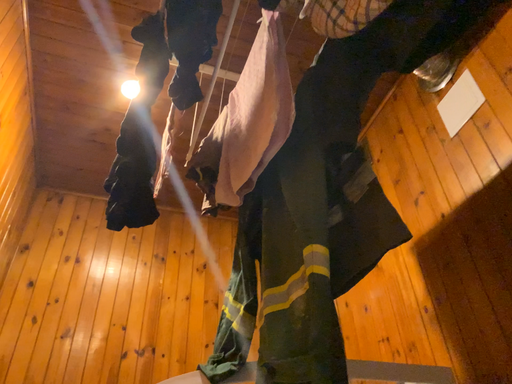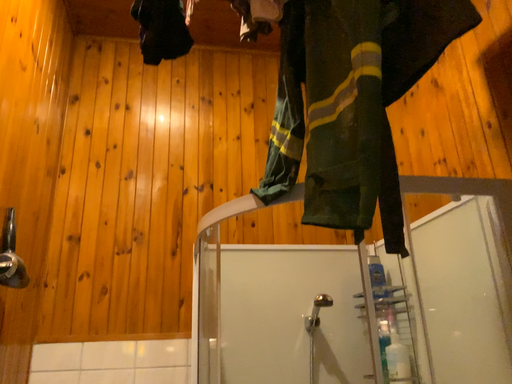
Question: Which way did the camera rotate in the video?

Choices:
 (A) rotated downward
 (B) rotated upward

Answer: (A)